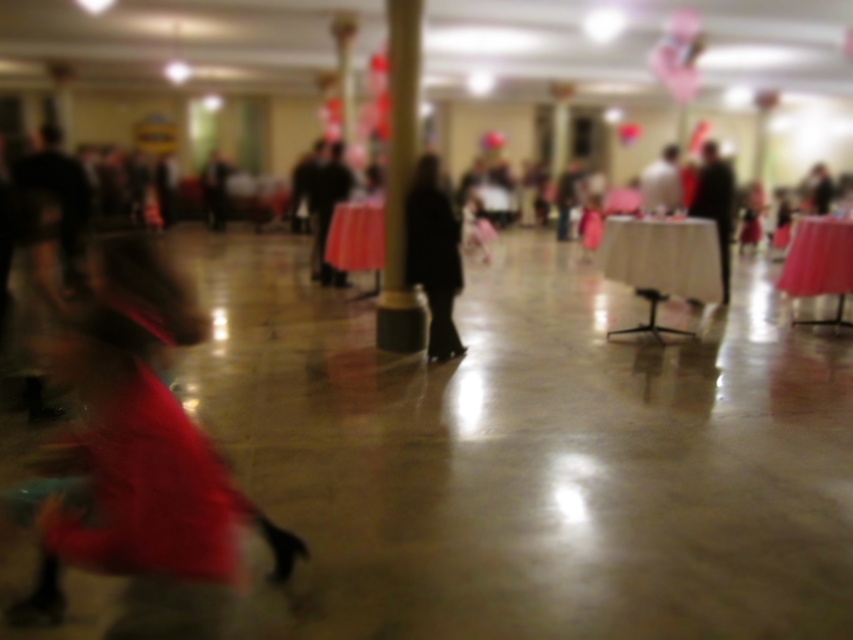
Question: Is black matte coat at center behind smooth pink table at right?

Choices:
 (A) yes
 (B) no

Answer: (B)

Question: Which of the following is the closest to the observer?

Choices:
 (A) (421, 240)
 (B) (355, 268)
 (C) (838, 296)
 (D) (708, 184)

Answer: (A)

Question: Which point is farther to the camera?

Choices:
 (A) (421, 196)
 (B) (383, 259)
 (C) (697, 184)

Answer: (C)

Question: Which point is closer to the camera taking this photo?

Choices:
 (A) (361, 205)
 (B) (704, 198)

Answer: (A)

Question: Is white fabric table at center closer to camera compared to pink fabric table at center?

Choices:
 (A) yes
 (B) no

Answer: (A)

Question: Does black matte coat at center appear under smooth pink table at right?

Choices:
 (A) yes
 (B) no

Answer: (B)